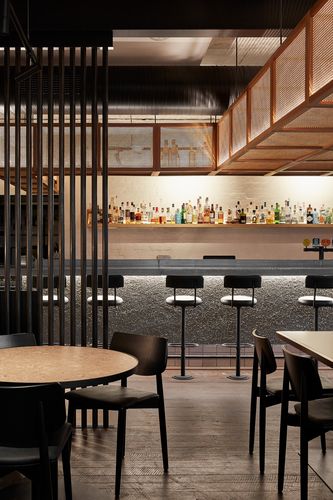
The width and height of the screenshot is (333, 500). In order to click on round wooden table in this screenshot , I will do `click(50, 364)`.